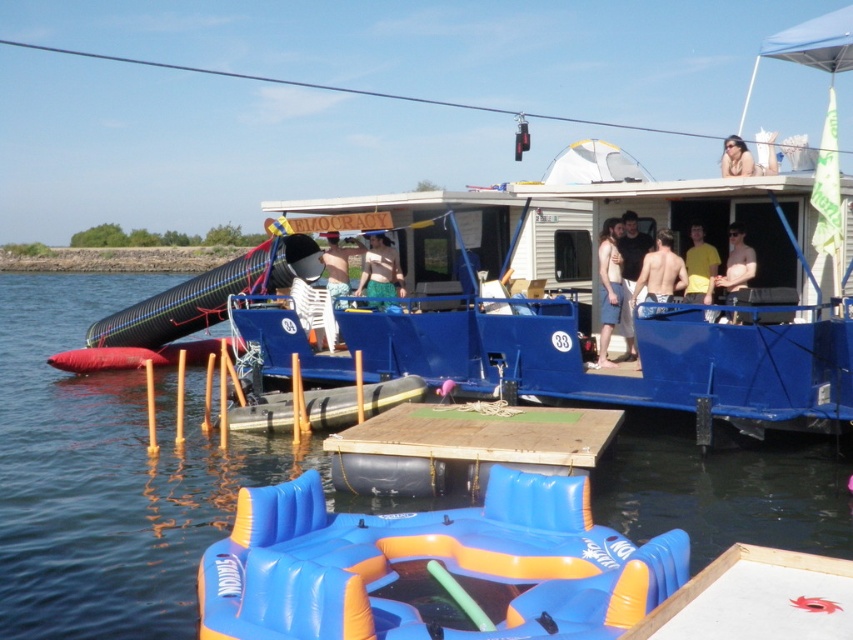
Does beige fabric shorts at center have a larger size compared to skinny man at center?

Indeed, beige fabric shorts at center has a larger size compared to skinny man at center.

Can you confirm if beige fabric shorts at center is smaller than skinny man at center?

Incorrect, beige fabric shorts at center is not smaller in size than skinny man at center.

Which is in front, point (621, 300) or point (645, 288)?

Point (645, 288)

Locate an element on the screen. This screenshot has width=853, height=640. beige fabric shorts at center is located at coordinates (608, 285).

Who is more distant from viewer, (540, 444) or (695, 224)?

Point (695, 224)

Which is in front, point (395, 429) or point (706, 253)?

Positioned in front is point (395, 429).

What do you see at coordinates (463, 445) in the screenshot? Image resolution: width=853 pixels, height=640 pixels. I see `wooden platform at center` at bounding box center [463, 445].

Locate an element on the screen. wooden platform at center is located at coordinates (463, 445).

Is blue inflatable raft at center thinner than skinny white man at center?

No, blue inflatable raft at center is not thinner than skinny white man at center.

Does blue inflatable raft at center come behind skinny white man at center?

No, it is not.

At what (x,y) coordinates should I click in order to perform the action: click on blue inflatable raft at center. Please return your answer as a coordinate pair (x, y). Image resolution: width=853 pixels, height=640 pixels. Looking at the image, I should click on (106, 474).